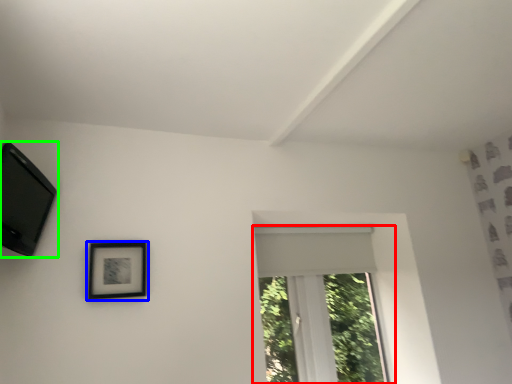
Question: Based on their relative distances, which object is nearer to window (highlighted by a red box)? Choose from picture frame (highlighted by a blue box) and picture frame (highlighted by a green box).

Choices:
 (A) picture frame
 (B) picture frame

Answer: (A)